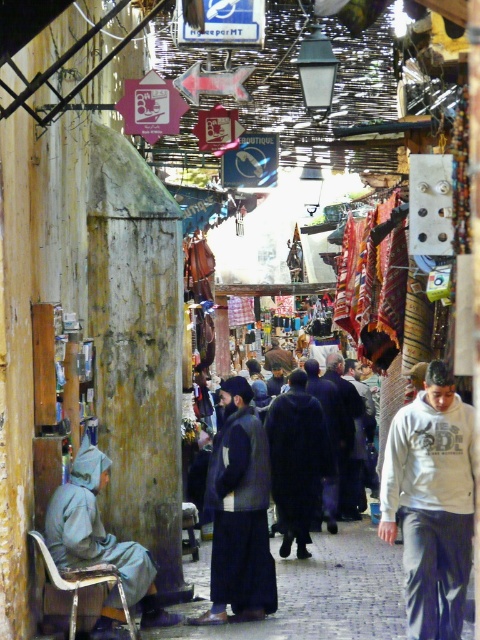
You are a delivery person carrying a large package that measures 12 feet in length. You need to navigate through the narrow alleyway between the dark brown fur coat at center and the dark blue wool coat at center. Based on the scene description, can you safely pass through this space without damaging the package or the surrounding items?

The distance between the dark brown fur coat at center and the dark blue wool coat at center is 10.76 feet. Since your package is 12 feet long, it is longer than the available space. Therefore, you cannot safely pass through without risking damage to the package or the surrounding items.